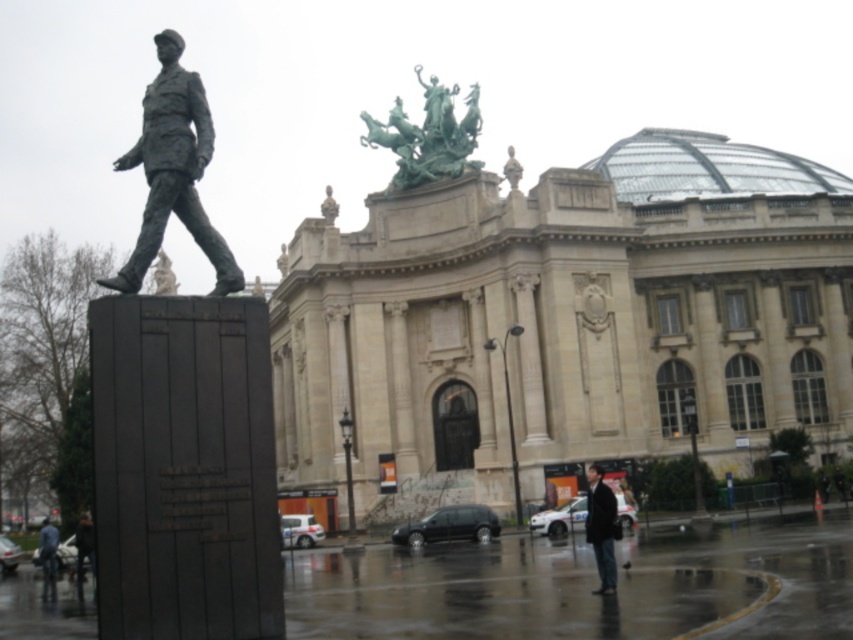
You are an art student who wants to sketch the green polished bronze statue at upper center and the dark brown leather jacket at lower center. Since you have limited time, you need to know which object is taller so you can focus on it first. Can you tell me which one is taller?

The green polished bronze statue at upper center is taller than the dark brown leather jacket at lower center according to the description.